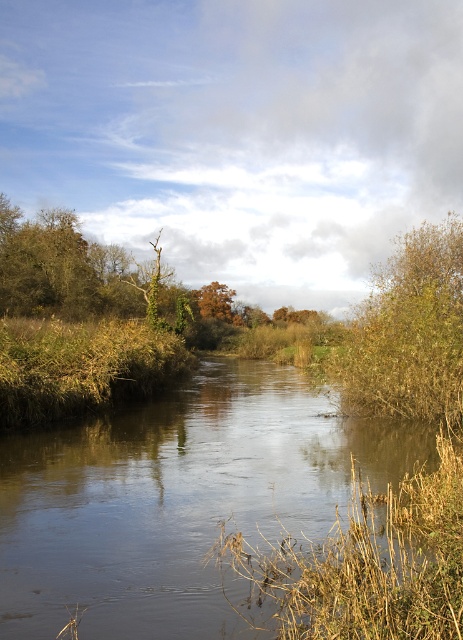
You are standing on the bank of the river and want to determine which object is taller between the smooth brown water at center and the orange matte tree at center. Can you tell me which one is taller?

The orange matte tree at center is taller than the smooth brown water at center.